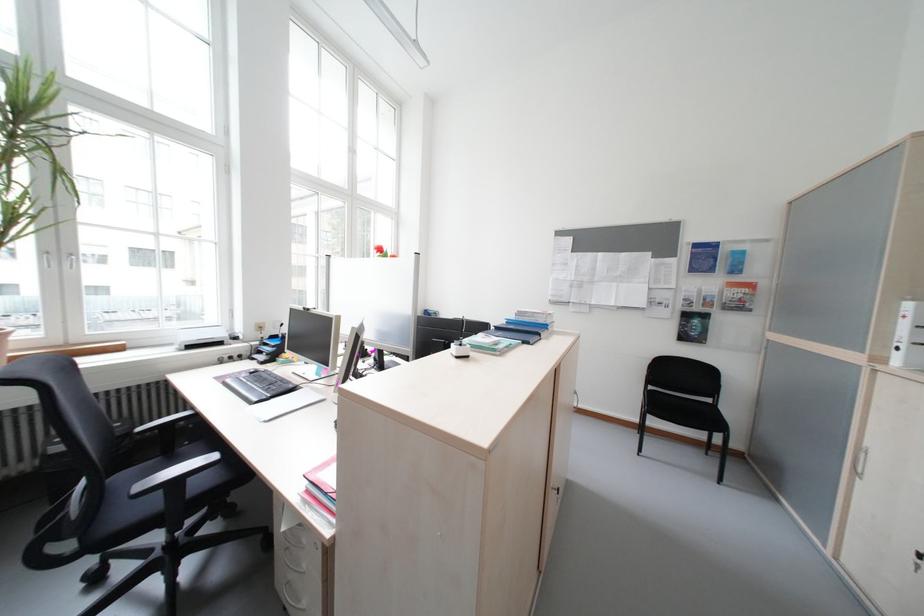
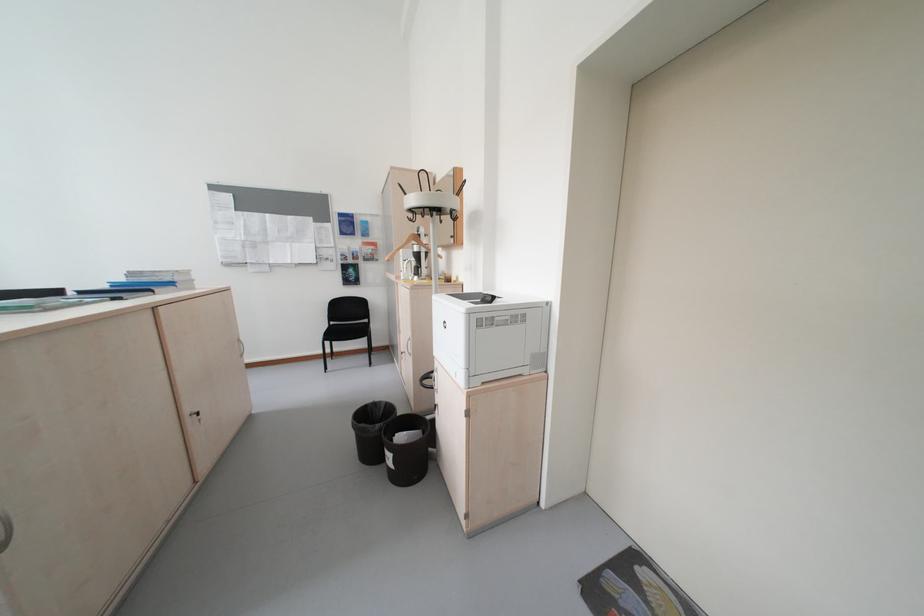
The point at (661, 389) is marked in the first image. Where is the corresponding point in the second image?

(343, 323)